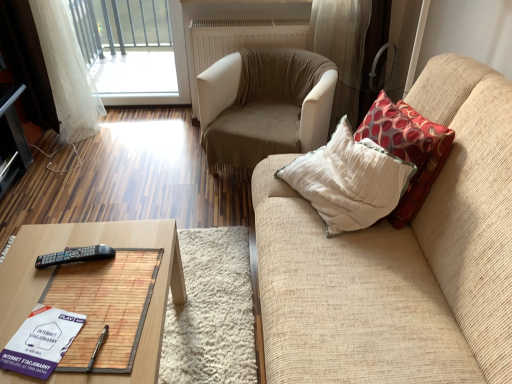
At what (x,y) coordinates should I click in order to perform the action: click on vacant space that is to the left of black plastic remote at lower left. Please return your answer as a coordinate pair (x, y). This screenshot has height=384, width=512. Looking at the image, I should click on (31, 258).